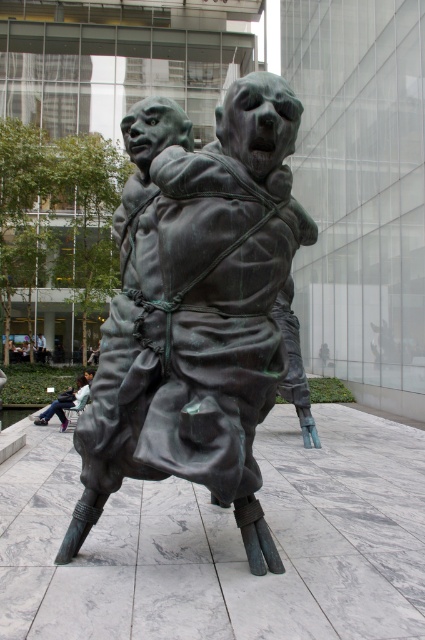
Question: Which point is closer to the camera?

Choices:
 (A) (258, 323)
 (B) (79, 396)

Answer: (A)

Question: Does green patina bronze statue at center appear over matte black jacket at lower left?

Choices:
 (A) yes
 (B) no

Answer: (A)

Question: Is green patina bronze statue at center thinner than matte black jacket at lower left?

Choices:
 (A) yes
 (B) no

Answer: (B)

Question: Which of the following is the closest to the observer?

Choices:
 (A) matte black jacket at lower left
 (B) green patina bronze statue at center

Answer: (B)

Question: Can you confirm if green patina bronze statue at center is positioned above matte black jacket at lower left?

Choices:
 (A) yes
 (B) no

Answer: (A)